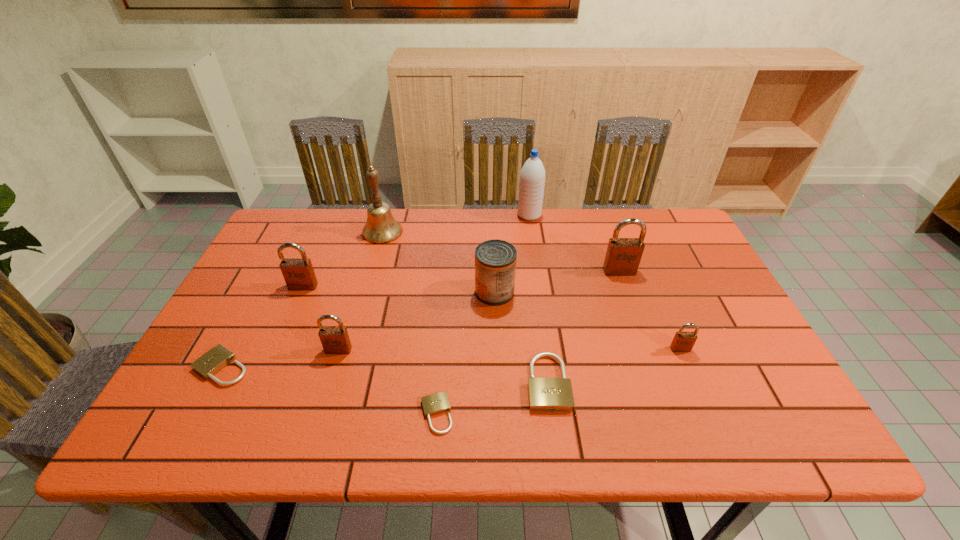
Where is `blank area located 0.280m on the front-facing side of the sixth padlock from left to right`? blank area located 0.280m on the front-facing side of the sixth padlock from left to right is located at coordinates (649, 355).

Locate an element on the screen. This screenshot has height=540, width=960. free space located 0.240m on the front-facing side of the second farthest brown padlock is located at coordinates (271, 362).

The width and height of the screenshot is (960, 540). I want to click on free space located 0.110m on the front of the red can, so click(x=496, y=338).

This screenshot has width=960, height=540. What are the coordinates of `free space located on the front-facing side of the fifth shortest object` in the screenshot? It's located at (332, 372).

Locate an element on the screen. vacant space situated 0.100m on the front-facing side of the smallest brown padlock is located at coordinates (697, 388).

Where is `vacant space located on the back of the rightmost beige padlock`? Image resolution: width=960 pixels, height=540 pixels. vacant space located on the back of the rightmost beige padlock is located at coordinates (534, 278).

This screenshot has height=540, width=960. I want to click on vacant point located on the right of the leftmost beige padlock, so click(406, 367).

Locate an element on the screen. The width and height of the screenshot is (960, 540). blank space located on the left of the fourth padlock from right to left is located at coordinates pos(291,414).

Locate an element on the screen. The width and height of the screenshot is (960, 540). water bottle situated at the far edge is located at coordinates (532, 177).

Where is `bell that is at the far edge`? Image resolution: width=960 pixels, height=540 pixels. bell that is at the far edge is located at coordinates (381, 227).